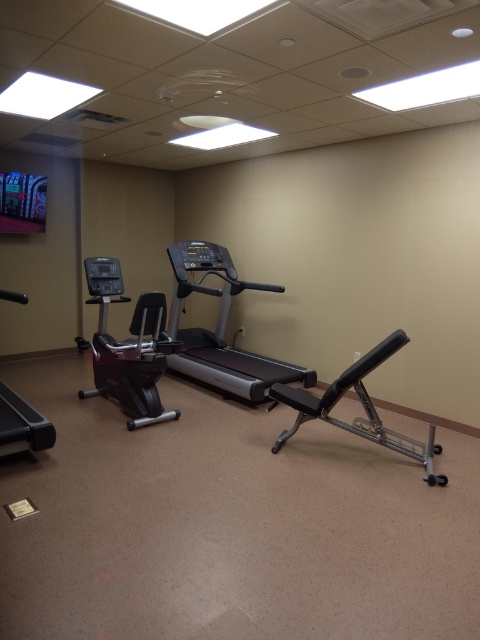
Who is more distant from viewer, (x=129, y=365) or (x=410, y=444)?

Positioned behind is point (x=129, y=365).

Can you confirm if black matte exercise bike at left is smaller than silver metallic weight bench at center?

No, black matte exercise bike at left is not smaller than silver metallic weight bench at center.

Is point (106, 369) closer to viewer compared to point (432, 454)?

That is False.

Locate an element on the screen. The width and height of the screenshot is (480, 640). black matte exercise bike at left is located at coordinates (128, 348).

Measure the distance from silver metallic treadmill at center to black matte exercise bike at left.

A distance of 38.02 inches exists between silver metallic treadmill at center and black matte exercise bike at left.

Does silver metallic treadmill at center appear on the left side of black matte exercise bike at left?

No, silver metallic treadmill at center is not to the left of black matte exercise bike at left.

Is point (204, 275) farther from viewer compared to point (135, 428)?

Yes, it is.

The height and width of the screenshot is (640, 480). Find the location of `silver metallic treadmill at center`. silver metallic treadmill at center is located at coordinates (222, 328).

Who is lower down, silver metallic treadmill at center or black rubber treadmill at left?

black rubber treadmill at left

Who is more forward, (180, 333) or (9, 435)?

Positioned in front is point (9, 435).

Describe the element at coordinates (222, 328) in the screenshot. I see `silver metallic treadmill at center` at that location.

Locate an element on the screen. This screenshot has width=480, height=640. silver metallic treadmill at center is located at coordinates (222, 328).